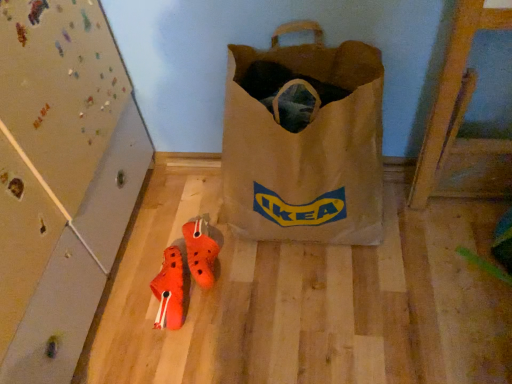
Locate an element on the screen. This screenshot has height=384, width=512. free spot to the left of brown paper bag at center is located at coordinates (170, 233).